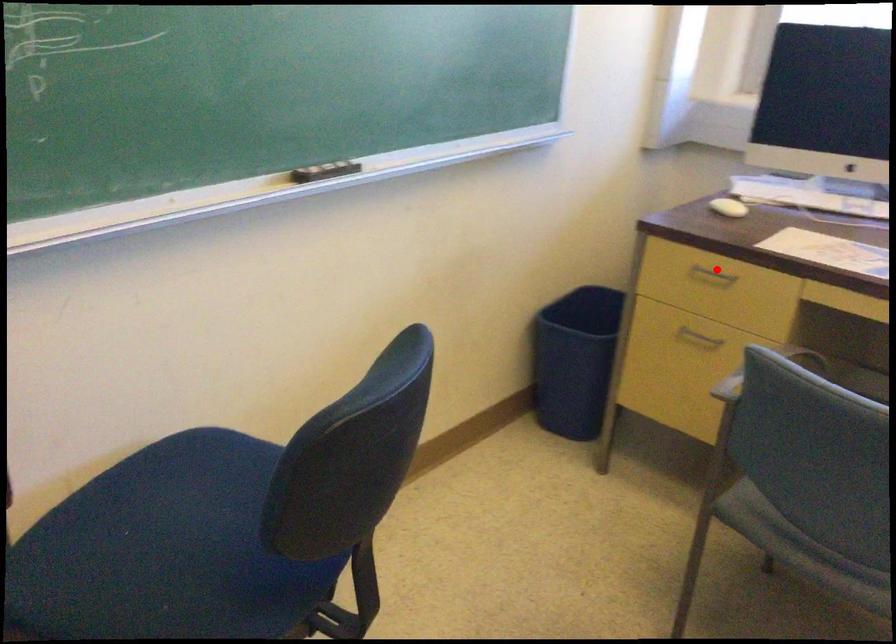
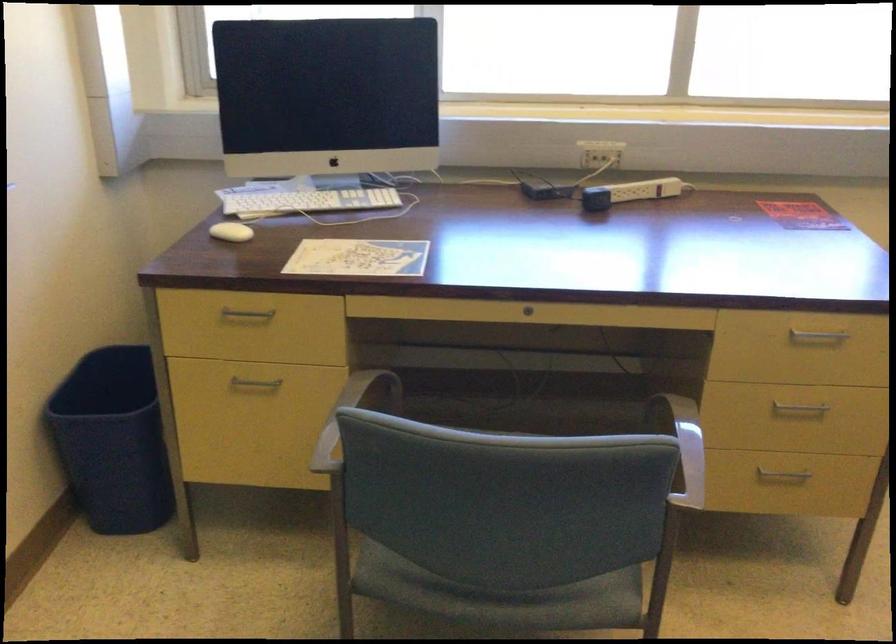
Question: I am providing you with two images of the same scene from different viewpoints. A red point is marked on the first image. At the location where the point appears in image 1, is it still visible in image 2?

Choices:
 (A) Yes
 (B) No

Answer: (A)